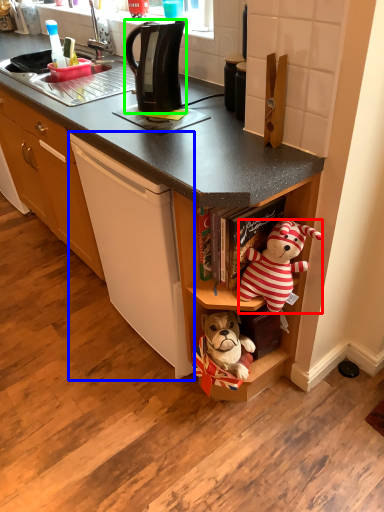
Question: Which object is positioned closest to teddy bear (highlighted by a red box)? Select from cording machine (highlighted by a blue box) and kitchen appliance (highlighted by a green box).

Choices:
 (A) cording machine
 (B) kitchen appliance

Answer: (A)